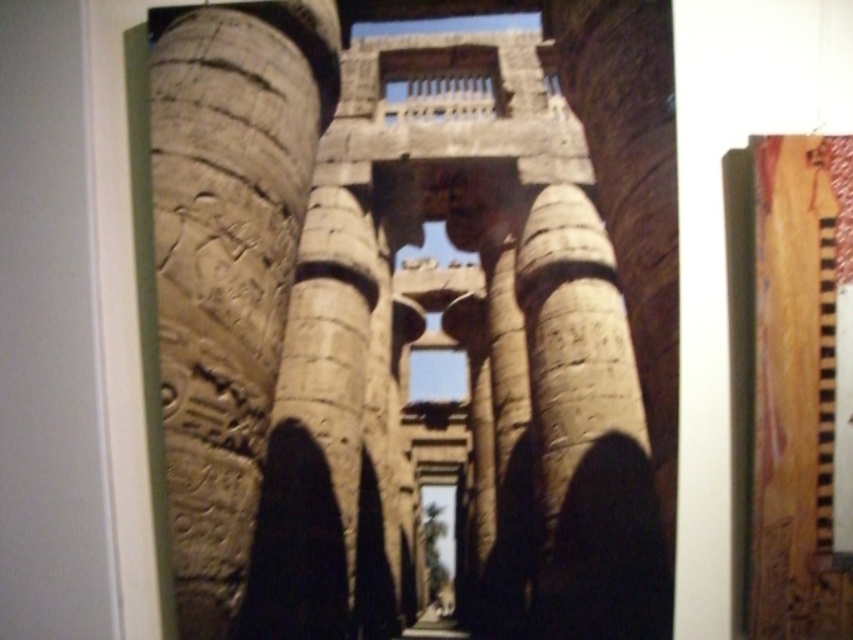
Based on the photo, who is positioned more to the right, carved stone columns at center or carved stone column at center?

Positioned to the right is carved stone column at center.

Where is `carved stone columns at center`? Image resolution: width=853 pixels, height=640 pixels. carved stone columns at center is located at coordinates point(407,307).

Does carved stone column at left have a larger size compared to carved stone column at center?

Incorrect, carved stone column at left is not larger than carved stone column at center.

Image resolution: width=853 pixels, height=640 pixels. In order to click on carved stone column at left in this screenshot , I will do `click(227, 262)`.

The height and width of the screenshot is (640, 853). In order to click on carved stone column at left in this screenshot , I will do `click(227, 262)`.

Consider the image. Can you confirm if carved stone columns at center is wider than carved stone column at left?

Yes, carved stone columns at center is wider than carved stone column at left.

Does point (616, 195) come farther from viewer compared to point (181, 96)?

Yes, it is.

Between point (328, 164) and point (306, 54), which one is positioned behind?

The point (328, 164) is behind.

At what (x,y) coordinates should I click in order to perform the action: click on carved stone columns at center. Please return your answer as a coordinate pair (x, y). Looking at the image, I should click on (407, 307).